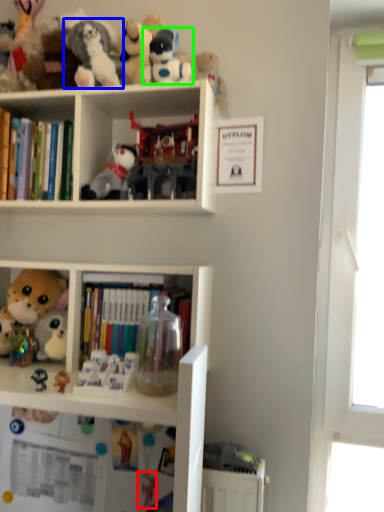
Question: Which object is the closest to the toy (highlighted by a red box)? Choose among these: toy (highlighted by a blue box) or toy (highlighted by a green box).

Choices:
 (A) toy
 (B) toy

Answer: (A)